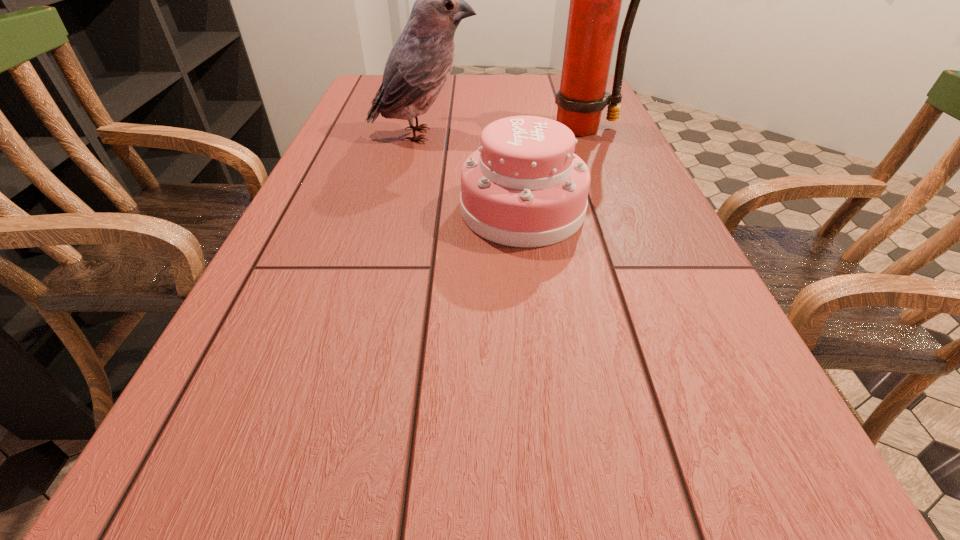
Where is `vacant region at the left edge of the desktop`? vacant region at the left edge of the desktop is located at coordinates (370, 128).

You are a GUI agent. You are given a task and a screenshot of the screen. Output one action in this format:
    pyautogui.click(x=<x>, y=<y>)
    Task: Click on the vacant area at the far left corner
    The height and width of the screenshot is (540, 960).
    Given the screenshot: What is the action you would take?
    pyautogui.click(x=366, y=90)

Find the location of a particular element. object that is the closest to the parrot is located at coordinates (524, 187).

This screenshot has width=960, height=540. I want to click on the second closest object relative to the second tallest object, so click(x=595, y=0).

You are a GUI agent. You are given a task and a screenshot of the screen. Output one action in this format:
    pyautogui.click(x=<x>, y=<y>)
    Task: Click on the vacant region that satisfies the following two spatial constraints: 1. at the nozzle of the tallest object; 2. on the front-facing side of the second shortest object
    
    Given the screenshot: What is the action you would take?
    pyautogui.click(x=588, y=134)

Locate an element on the screen. free space in the image that satisfies the following two spatial constraints: 1. on the front-facing side of the shortest object; 2. on the right side of the parrot is located at coordinates (407, 210).

In order to click on free region that satisfies the following two spatial constraints: 1. on the front-facing side of the shortest object; 2. on the right side of the second shortest object in this screenshot , I will do `click(407, 210)`.

The image size is (960, 540). What are the coordinates of `free space that satisfies the following two spatial constraints: 1. on the front-facing side of the birthday cake; 2. on the right side of the parrot` in the screenshot? It's located at (407, 210).

Identify the location of vacant area in the image that satisfies the following two spatial constraints: 1. on the front-facing side of the second tallest object; 2. on the right side of the shortest object. This screenshot has height=540, width=960. (407, 210).